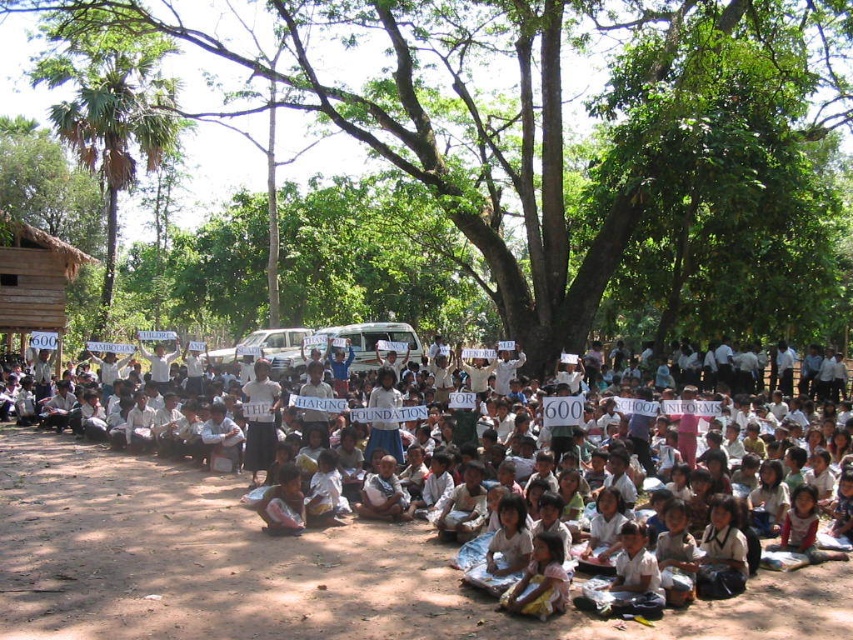
Can you confirm if green leafy tree at center is positioned to the left of green leafy tree at upper left?

In fact, green leafy tree at center is to the right of green leafy tree at upper left.

Between green leafy tree at center and green leafy tree at upper left, which one is positioned lower?

green leafy tree at upper left is below.

Does point (233, 29) come behind point (68, 65)?

Yes, point (233, 29) is behind point (68, 65).

Locate an element on the screen. green leafy tree at center is located at coordinates (566, 140).

Measure the distance between point (788, 499) and camera.

38.92 meters

Is point (10, 593) in front of point (97, 140)?

Yes, it is in front of point (97, 140).

This screenshot has height=640, width=853. Find the location of `white cloth sign at center`. white cloth sign at center is located at coordinates (283, 564).

Does green leafy tree at center have a larger size compared to white cloth sign at center?

Yes, green leafy tree at center is bigger than white cloth sign at center.

Is green leafy tree at center in front of white cloth sign at center?

No.

The height and width of the screenshot is (640, 853). What do you see at coordinates (566, 140) in the screenshot?
I see `green leafy tree at center` at bounding box center [566, 140].

Locate an element on the screen. This screenshot has height=640, width=853. green leafy tree at center is located at coordinates (566, 140).